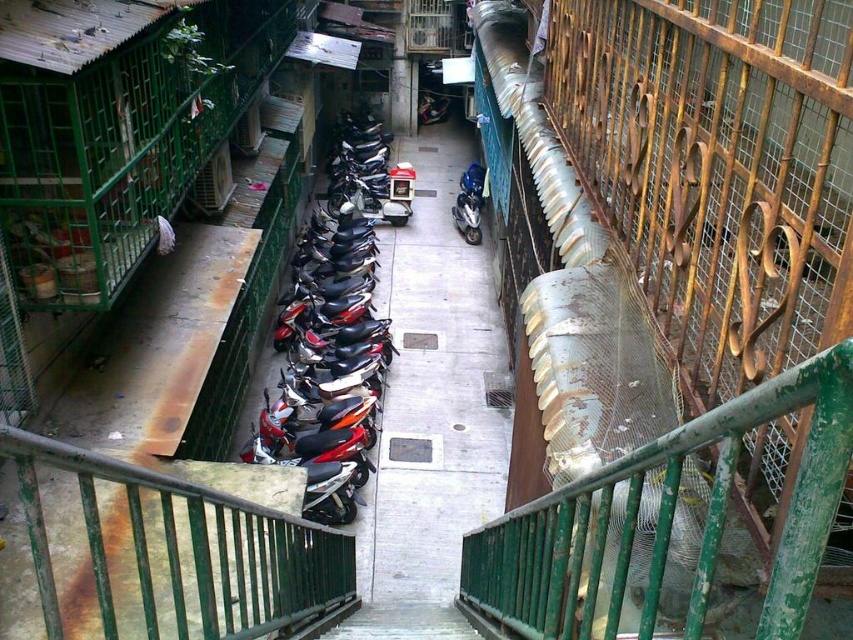
Which is above, green painted metal railing at upper right or blue metallic motorcycle at center?

blue metallic motorcycle at center is higher up.

Is point (651, 572) less distant than point (456, 200)?

Yes, point (651, 572) is closer to viewer.

Is point (776, 609) positioned in front of point (480, 184)?

Yes, it is in front of point (480, 184).

The width and height of the screenshot is (853, 640). In order to click on green painted metal railing at upper right in this screenshot , I will do `click(663, 522)`.

Which of these two, shiny metallic motorcycle at center or blue metallic motorcycle at center, stands taller?

shiny metallic motorcycle at center

Is shiny metallic motorcycle at center to the right of blue metallic motorcycle at center from the viewer's perspective?

No, shiny metallic motorcycle at center is not to the right of blue metallic motorcycle at center.

Is point (335, 401) positioned behind point (471, 211)?

No.

The image size is (853, 640). Find the location of `shiny metallic motorcycle at center`. shiny metallic motorcycle at center is located at coordinates (334, 342).

Does green painted metal railing at upper right come behind shiny metallic motorcycle at center?

No, green painted metal railing at upper right is closer to the viewer.

Between point (675, 472) and point (341, 458), which one is positioned behind?

The point (341, 458) is more distant.

Who is more distant from viewer, (692,600) or (287,435)?

The point (287,435) is behind.

Find the location of a particular element. green painted metal railing at upper right is located at coordinates (663, 522).